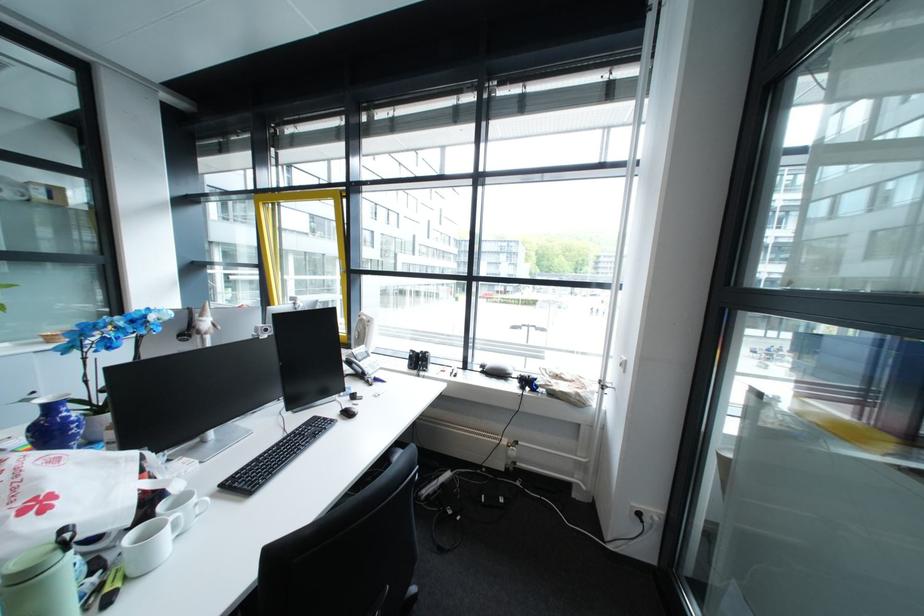
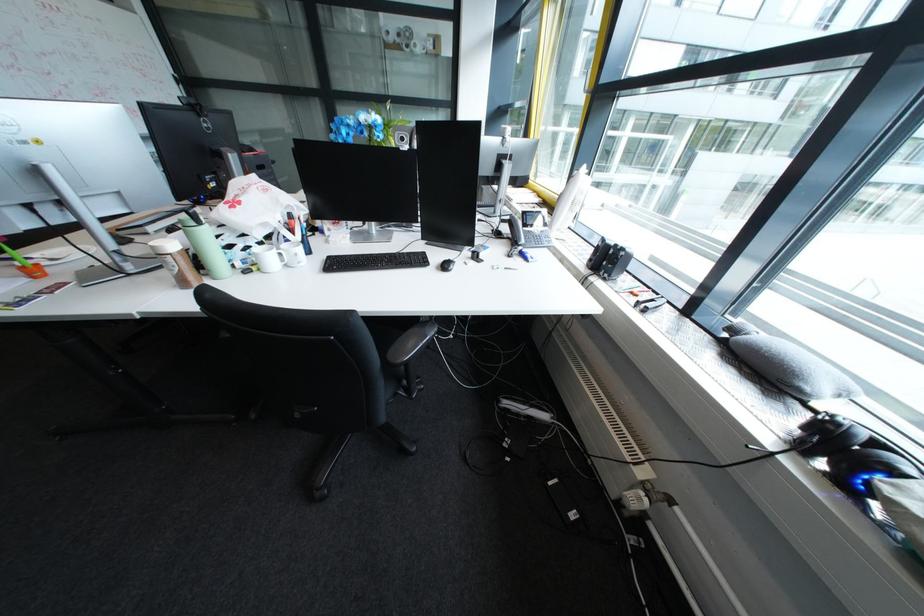
The first image is from the beginning of the video and the second image is from the end. How did the camera likely rotate when shooting the video?

The camera's rotation is toward left-down.